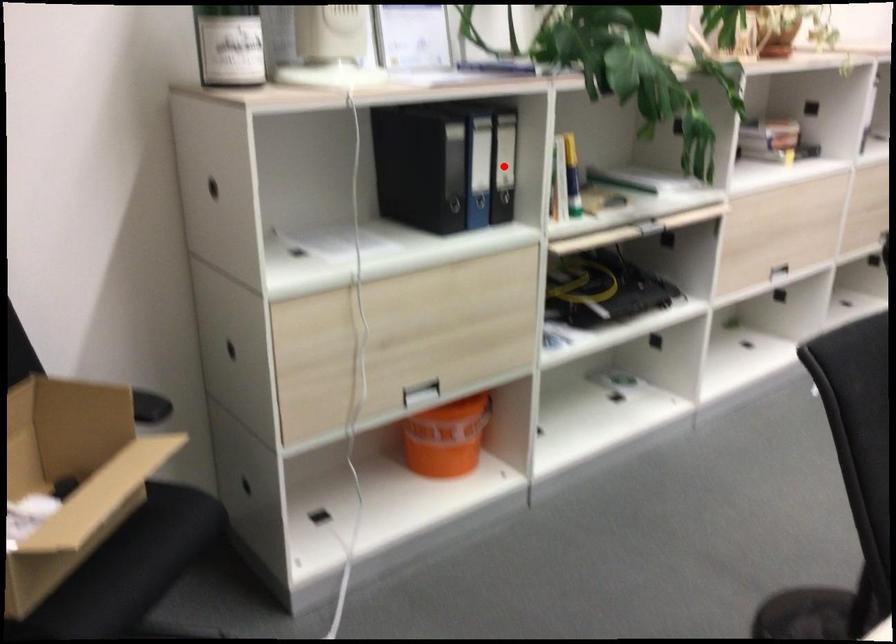
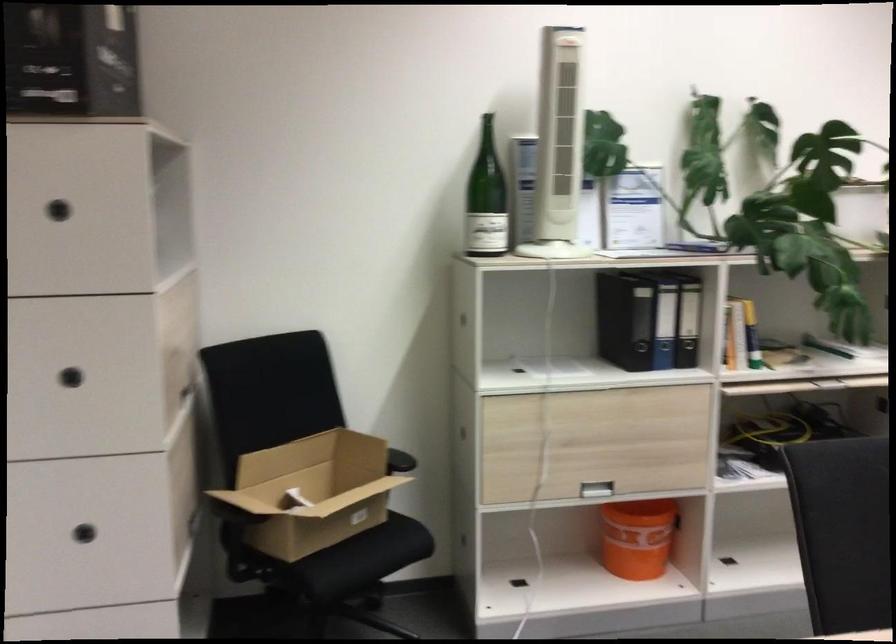
Locate, in the second image, the point that corresponds to the highlighted location in the first image.

(688, 321)